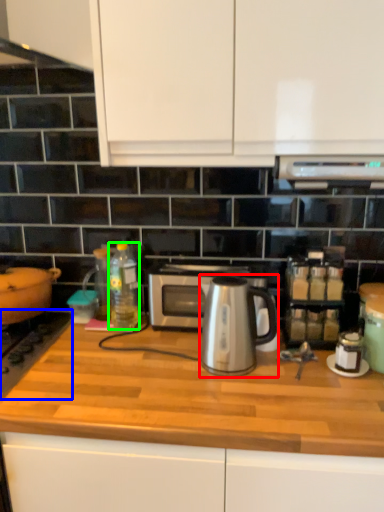
Question: Based on their relative distances, which object is farther from coffeepot (highlighted by a red box)? Choose from gas stove (highlighted by a blue box) and bottle (highlighted by a green box).

Choices:
 (A) gas stove
 (B) bottle

Answer: (A)